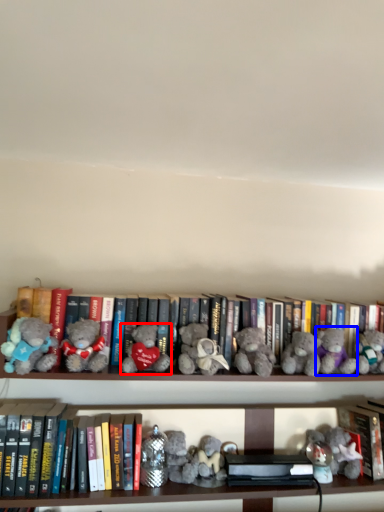
Question: Which point is further to the camera, teddy bear (highlighted by a red box) or teddy bear (highlighted by a blue box)?

Choices:
 (A) teddy bear
 (B) teddy bear

Answer: (B)